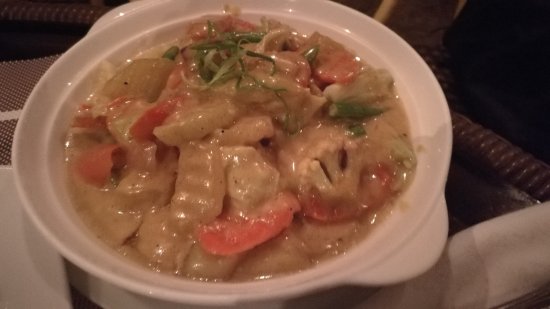
The width and height of the screenshot is (550, 309). What are the coordinates of `carpet` in the screenshot? It's located at (420, 23).